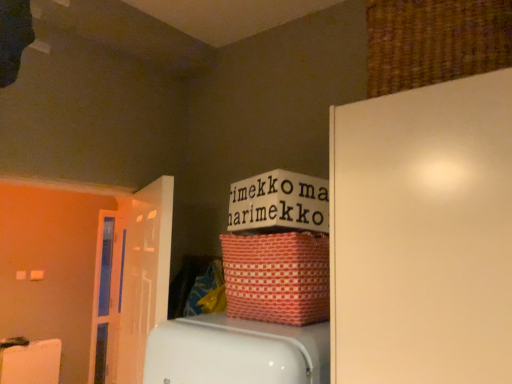
Question: Considering the positions of point (100, 261) and point (267, 278), is point (100, 261) closer or farther from the camera than point (267, 278)?

Choices:
 (A) farther
 (B) closer

Answer: (A)

Question: In terms of height, does transparent glass door at left, which is the second door from front to back, look taller or shorter compared to red woven basket at upper center, which is the 2th basket from right to left?

Choices:
 (A) tall
 (B) short

Answer: (A)

Question: Based on their relative distances, which object is farther from the transparent glass door at left, positioned as the 1th door in back-to-front order?

Choices:
 (A) woven brown basket at upper right, the 1th basket positioned from the right
 (B) white glossy door at left, the 1th door positioned from the front
 (C) red woven basket at upper center, arranged as the 2th basket when viewed from the top

Answer: (A)

Question: Estimate the real-world distances between objects in this image. Which object is farther from the transparent glass door at left, the 2th door in the right-to-left sequence?

Choices:
 (A) woven brown basket at upper right, arranged as the 1th basket when viewed from the top
 (B) white glossy door at left, the first door positioned from the right
 (C) red woven basket at upper center, the first basket from the left

Answer: (A)